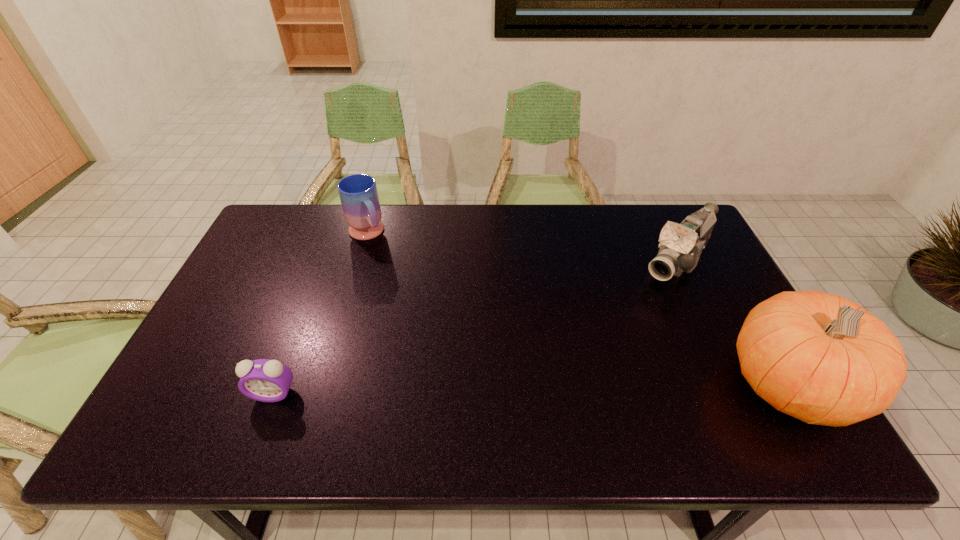
Find the location of a particular element. free space that is in between the camcorder and the alarm clock is located at coordinates (475, 327).

Locate an element on the screen. object that is the second closest to the tallest object is located at coordinates [358, 193].

Locate an element on the screen. object that stands as the second closest to the pumpkin is located at coordinates (358, 193).

Locate an element on the screen. Image resolution: width=960 pixels, height=540 pixels. vacant point that satisfies the following two spatial constraints: 1. on the front side of the tallest object; 2. on the front-facing side of the camcorder is located at coordinates (736, 386).

Find the location of a particular element. The height and width of the screenshot is (540, 960). free space that satisfies the following two spatial constraints: 1. on the front side of the pumpkin; 2. on the front-facing side of the mug is located at coordinates (322, 386).

This screenshot has height=540, width=960. I want to click on blank space that satisfies the following two spatial constraints: 1. on the front side of the mug; 2. on the front-facing side of the tallest object, so click(x=322, y=386).